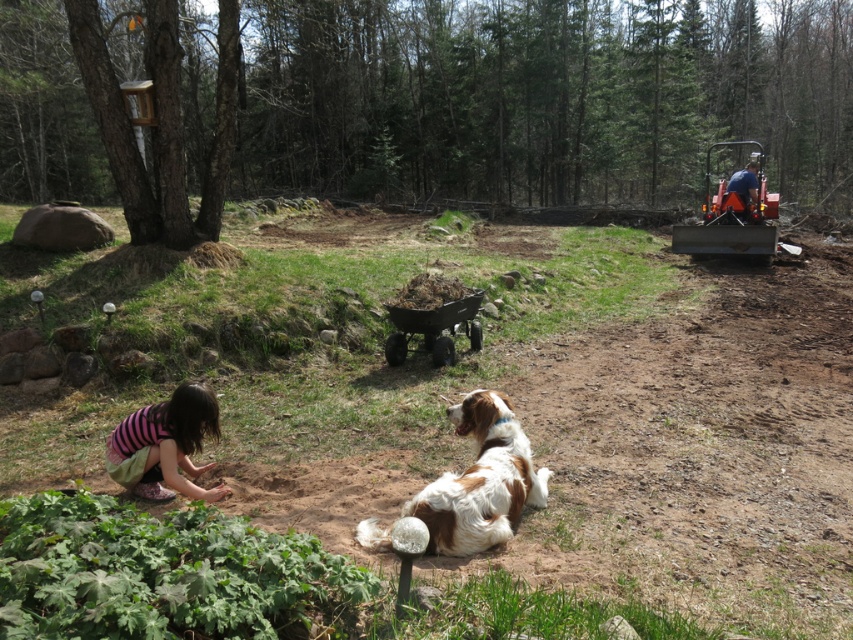
You are standing at the point labeled as point (728, 192) and want to walk to the point labeled as point (498, 518). Based on the scene description, which direction should you move to reach your destination?

You should move forward because point (498, 518) is in front of point (728, 192).

You are a photographer setting up a shot of the brown and white fur at center and the blue fabric at upper right. Which object should you zoom in on to capture more detail without moving the camera, considering their sizes?

The brown and white fur at center is smaller in width than the blue fabric at upper right, so you should zoom in on the brown and white fur at center to capture more detail since it is smaller and requires closer focus.